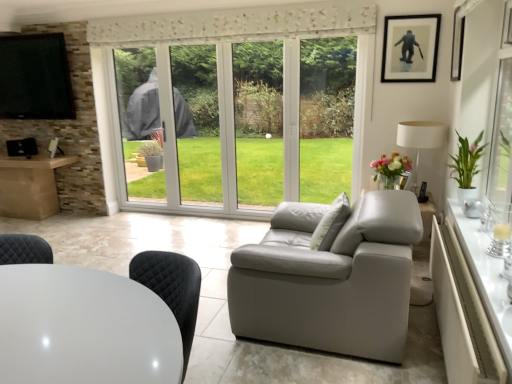
What do you see at coordinates (84, 328) in the screenshot? I see `white glossy table at lower left, which is counted as the second table, starting from the right` at bounding box center [84, 328].

The height and width of the screenshot is (384, 512). What are the coordinates of `black glossy picture frame at upper right, the 2th picture frame from the back` in the screenshot? It's located at (457, 45).

This screenshot has width=512, height=384. Describe the element at coordinates (410, 48) in the screenshot. I see `black matte picture frame at upper right, which appears as the second picture frame when viewed from the front` at that location.

Identify the location of white glossy table at lower left, the 1th table viewed from the left. The height and width of the screenshot is (384, 512). (84, 328).

Is white glossy table at lower left, the 1th table viewed from the left, next to white fabric lampshade at right?

No, white glossy table at lower left, the 1th table viewed from the left, is not beside white fabric lampshade at right.

Between white glossy table at lower left, the 1th table viewed from the left, and white fabric lampshade at right, which one appears on the right side from the viewer's perspective?

white fabric lampshade at right.

Considering the relative sizes of white glossy table at lower left, the 1th table viewed from the left, and white fabric lampshade at right in the image provided, is white glossy table at lower left, the 1th table viewed from the left, thinner than white fabric lampshade at right?

No.

In the scene shown: Can you confirm if white glossy table at lower left, the 1th table viewed from the left, is taller than white fabric lampshade at right?

No, white glossy table at lower left, the 1th table viewed from the left, is not taller than white fabric lampshade at right.

Is white glossy table at right, the first table from the right, placed right next to white glossy table at lower left, which is counted as the second table, starting from the right?

No, white glossy table at right, the first table from the right, is not in contact with white glossy table at lower left, which is counted as the second table, starting from the right.

Which object is further away from the camera taking this photo, white glossy table at right, the first table from the right, or white glossy table at lower left, which is counted as the second table, starting from the right?

white glossy table at right, the first table from the right, is further from the camera.

Considering the sizes of white glossy table at right, the second table from the left, and white glossy table at lower left, which is counted as the second table, starting from the right, in the image, is white glossy table at right, the second table from the left, taller or shorter than white glossy table at lower left, which is counted as the second table, starting from the right,?

Clearly, white glossy table at right, the second table from the left, is shorter compared to white glossy table at lower left, which is counted as the second table, starting from the right.

Is white glossy table at right, the second table from the left, thinner than white glossy table at lower left, the 1th table viewed from the left?

Yes, white glossy table at right, the second table from the left, is thinner than white glossy table at lower left, the 1th table viewed from the left.

Measure the distance from white glossy table at right, the second table from the left, to black glossy tv at upper left.

A distance of 4.61 meters exists between white glossy table at right, the second table from the left, and black glossy tv at upper left.

Is white glossy table at right, the second table from the left, bigger or smaller than black glossy tv at upper left?

Clearly, white glossy table at right, the second table from the left, is smaller in size than black glossy tv at upper left.

Would you consider white glossy table at right, the first table from the right, to be distant from black glossy tv at upper left?

white glossy table at right, the first table from the right, is far away from black glossy tv at upper left.

From a real-world perspective, does white glossy table at right, the first table from the right, sit lower than black glossy tv at upper left?

Yes.

Can you confirm if black matte picture frame at upper right, which appears as the second picture frame when viewed from the front, is taller than black glossy picture frame at upper right, which appears as the 1th picture frame when viewed from the front?

No.

Which is in front, black matte picture frame at upper right, which appears as the second picture frame when viewed from the front, or black glossy picture frame at upper right, which appears as the 1th picture frame when viewed from the front?

black glossy picture frame at upper right, which appears as the 1th picture frame when viewed from the front, is in front.

How many degrees apart are the facing directions of black matte picture frame at upper right, positioned as the 1th picture frame in back-to-front order, and black glossy picture frame at upper right, which appears as the 1th picture frame when viewed from the front?

The angular difference between black matte picture frame at upper right, positioned as the 1th picture frame in back-to-front order, and black glossy picture frame at upper right, which appears as the 1th picture frame when viewed from the front, is 90.7 degrees.

Which is closer, [402,74] or [460,76]?

Point [402,74].

Considering the sizes of objects black glossy picture frame at upper right, the 2th picture frame from the back, and black matte picture frame at upper right, which appears as the second picture frame when viewed from the front, in the image provided, who is shorter, black glossy picture frame at upper right, the 2th picture frame from the back, or black matte picture frame at upper right, which appears as the second picture frame when viewed from the front,?

Standing shorter between the two is black matte picture frame at upper right, which appears as the second picture frame when viewed from the front.

Considering the sizes of objects black glossy picture frame at upper right, which appears as the 1th picture frame when viewed from the front, and black matte picture frame at upper right, positioned as the 1th picture frame in back-to-front order, in the image provided, who is wider, black glossy picture frame at upper right, which appears as the 1th picture frame when viewed from the front, or black matte picture frame at upper right, positioned as the 1th picture frame in back-to-front order,?

Wider between the two is black glossy picture frame at upper right, which appears as the 1th picture frame when viewed from the front.

Does black glossy picture frame at upper right, which appears as the 1th picture frame when viewed from the front, touch black matte picture frame at upper right, which appears as the second picture frame when viewed from the front?

No, black glossy picture frame at upper right, which appears as the 1th picture frame when viewed from the front, is not beside black matte picture frame at upper right, which appears as the second picture frame when viewed from the front.

Considering the relative positions of black glossy picture frame at upper right, the 2th picture frame from the back, and black matte picture frame at upper right, which appears as the second picture frame when viewed from the front, in the image provided, is black glossy picture frame at upper right, the 2th picture frame from the back, to the left or to the right of black matte picture frame at upper right, which appears as the second picture frame when viewed from the front,?

black glossy picture frame at upper right, the 2th picture frame from the back, is to the right of black matte picture frame at upper right, which appears as the second picture frame when viewed from the front.

In the scene shown: Between black matte picture frame at upper right, positioned as the 1th picture frame in back-to-front order, and white glossy table at lower left, the 1th table viewed from the left, which one appears on the left side from the viewer's perspective?

Positioned to the left is white glossy table at lower left, the 1th table viewed from the left.

Is black matte picture frame at upper right, which appears as the second picture frame when viewed from the front, further to the viewer compared to white glossy table at lower left, which is counted as the second table, starting from the right?

Yes, black matte picture frame at upper right, which appears as the second picture frame when viewed from the front, is further from the viewer.

Is black matte picture frame at upper right, which appears as the second picture frame when viewed from the front, in contact with white glossy table at lower left, the 1th table viewed from the left?

No, black matte picture frame at upper right, which appears as the second picture frame when viewed from the front, is not touching white glossy table at lower left, the 1th table viewed from the left.

Considering the positions of objects white textured pillow at center and black matte picture frame at upper right, positioned as the 1th picture frame in back-to-front order, in the image provided, who is more to the right, white textured pillow at center or black matte picture frame at upper right, positioned as the 1th picture frame in back-to-front order,?

black matte picture frame at upper right, positioned as the 1th picture frame in back-to-front order, is more to the right.

Is white textured pillow at center far from black matte picture frame at upper right, positioned as the 1th picture frame in back-to-front order?

Yes.

From the white textured pillow at center, count 1st picture frame to the right and point to it. Please provide its 2D coordinates.

[(410, 48)]

From a real-world perspective, is white textured pillow at center positioned above or below black matte picture frame at upper right, which appears as the second picture frame when viewed from the front?

Clearly, from a real-world perspective, white textured pillow at center is below black matte picture frame at upper right, which appears as the second picture frame when viewed from the front.

Locate an element on the screen. lamp that appears above the white glossy table at lower left, which is counted as the second table, starting from the right (from a real-world perspective) is located at coordinates (419, 142).

The width and height of the screenshot is (512, 384). I want to click on table below the white glossy table at lower left, the 1th table viewed from the left (from a real-world perspective), so click(462, 314).

Looking at the image, which one is located closer to white fabric lampshade at right, black glossy picture frame at upper right, which appears as the 1th picture frame when viewed from the front, or white textured pillow at center?

black glossy picture frame at upper right, which appears as the 1th picture frame when viewed from the front.

Estimate the real-world distances between objects in this image. Which object is further from black glossy picture frame at upper right, the 2th picture frame from the back, white glossy table at lower left, which is counted as the second table, starting from the right, or white fabric lampshade at right?

white glossy table at lower left, which is counted as the second table, starting from the right, is further to black glossy picture frame at upper right, the 2th picture frame from the back.

Based on their spatial positions, is black matte picture frame at upper right, positioned as the 1th picture frame in back-to-front order, or black glossy tv at upper left further from white fabric lampshade at right?

black glossy tv at upper left is further to white fabric lampshade at right.

Estimate the real-world distances between objects in this image. Which object is further from white textured pillow at center, white glossy table at lower left, which is counted as the second table, starting from the right, or white glossy table at right, the second table from the left?

white glossy table at lower left, which is counted as the second table, starting from the right, is positioned further to the anchor white textured pillow at center.

Estimate the real-world distances between objects in this image. Which object is closer to white glossy table at lower left, the 1th table viewed from the left, white glossy table at right, the first table from the right, or white textured pillow at center?

white glossy table at right, the first table from the right.

Considering their positions, is white glossy table at right, the second table from the left, positioned closer to black glossy picture frame at upper right, the 2th picture frame from the back, than white fabric lampshade at right?

white fabric lampshade at right lies closer to black glossy picture frame at upper right, the 2th picture frame from the back, than the other object.

When comparing their distances from white glossy table at right, the first table from the right, does white glossy table at lower left, which is counted as the second table, starting from the right, or white textured pillow at center seem closer?

Based on the image, white textured pillow at center appears to be nearer to white glossy table at right, the first table from the right.

Looking at this image, when comparing their distances from white textured pillow at center, does black matte picture frame at upper right, which appears as the second picture frame when viewed from the front, or black glossy picture frame at upper right, which appears as the 1th picture frame when viewed from the front, seem closer?

black glossy picture frame at upper right, which appears as the 1th picture frame when viewed from the front, is closer to white textured pillow at center.

Find the location of a particular element. table located between white glossy table at lower left, which is counted as the second table, starting from the right, and black glossy tv at upper left in the depth direction is located at coordinates (462, 314).

This screenshot has width=512, height=384. Identify the location of picture frame situated between black glossy tv at upper left and black glossy picture frame at upper right, the 2th picture frame from the back, from left to right. (410, 48).

You are a GUI agent. You are given a task and a screenshot of the screen. Output one action in this format:
    pyautogui.click(x=<x>, y=<y>)
    Task: Click on the pillow between white glossy table at lower left, which is counted as the second table, starting from the right, and black glossy tv at upper left in the front-back direction
    The image size is (512, 384).
    Given the screenshot: What is the action you would take?
    pyautogui.click(x=331, y=224)

This screenshot has height=384, width=512. What are the coordinates of `picture frame between white glossy table at right, the second table from the left, and white fabric lampshade at right in the front-back direction` in the screenshot? It's located at (457, 45).